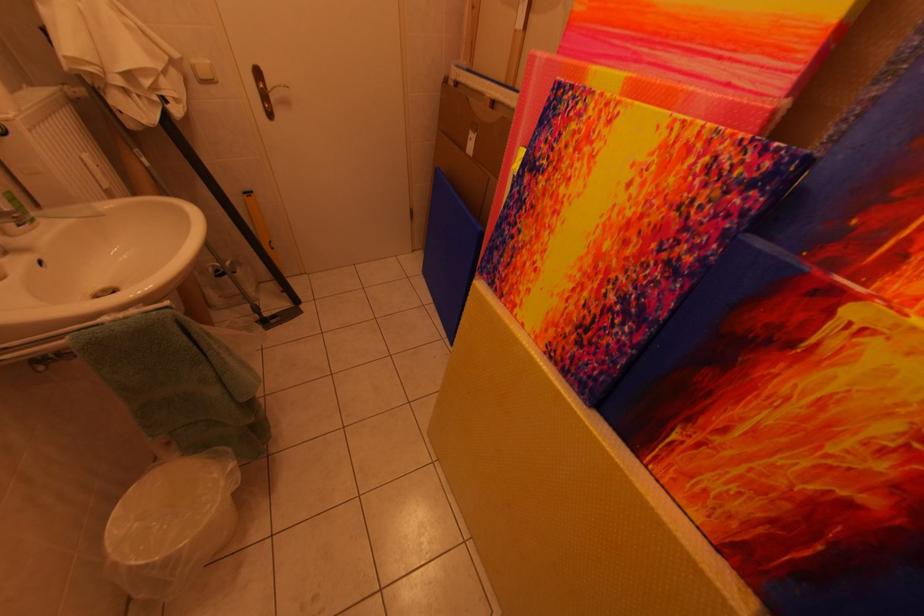
Find where to pull the brass door handle. Please return your answer as a coordinate pair (x, y).

(262, 91)